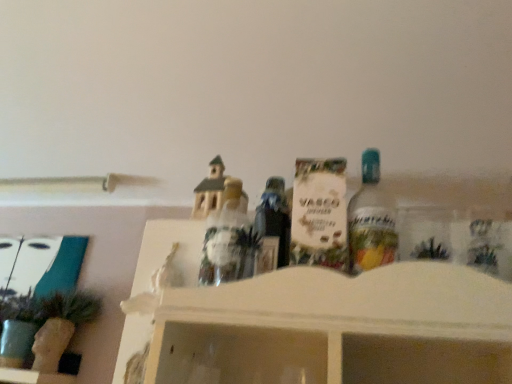
Question: Are clear glass bottle at center-right and matte brown house at center, the 2th toy positioned from the right, far apart?

Choices:
 (A) yes
 (B) no

Answer: (B)

Question: Does clear glass bottle at center-right have a smaller size compared to matte brown house at center, the second toy positioned from the left?

Choices:
 (A) yes
 (B) no

Answer: (A)

Question: Is clear glass bottle at center-right at the right side of matte brown house at center, the 2th toy positioned from the right?

Choices:
 (A) yes
 (B) no

Answer: (A)

Question: Is clear glass bottle at center-right outside matte brown house at center, the 2th toy positioned from the right?

Choices:
 (A) yes
 (B) no

Answer: (A)

Question: From the image's perspective, is clear glass bottle at center-right above matte brown house at center, the 2th toy positioned from the right?

Choices:
 (A) yes
 (B) no

Answer: (A)

Question: In terms of size, does clear glass bottle at center-right appear bigger or smaller than matte brown house at center, the 2th toy positioned from the right?

Choices:
 (A) small
 (B) big

Answer: (A)

Question: Does point (382, 258) appear closer or farther from the camera than point (224, 225)?

Choices:
 (A) farther
 (B) closer

Answer: (B)

Question: Is clear glass bottle at center-right situated inside matte brown house at center, the 2th toy positioned from the right, or outside?

Choices:
 (A) outside
 (B) inside

Answer: (A)

Question: Based on their positions, is clear glass bottle at center-right located to the left or right of matte brown house at center, the second toy positioned from the left?

Choices:
 (A) right
 (B) left

Answer: (A)

Question: Considering the positions of matte brown house at center, the second toy positioned from the left, and white matte box at center, arranged as the first toy when viewed from the right, in the image, is matte brown house at center, the second toy positioned from the left, bigger or smaller than white matte box at center, arranged as the first toy when viewed from the right,?

Choices:
 (A) big
 (B) small

Answer: (A)

Question: From the image's perspective, relative to white matte box at center, placed as the third toy when sorted from left to right, is matte brown house at center, the second toy positioned from the left, above or below?

Choices:
 (A) below
 (B) above

Answer: (A)

Question: Is matte brown house at center, the 2th toy positioned from the right, in front of or behind white matte box at center, placed as the third toy when sorted from left to right, in the image?

Choices:
 (A) front
 (B) behind

Answer: (B)

Question: Visually, is matte brown house at center, the 2th toy positioned from the right, positioned to the left or to the right of white matte box at center, arranged as the first toy when viewed from the right?

Choices:
 (A) right
 (B) left

Answer: (B)

Question: In terms of height, does translucent plastic figurine at center, the first toy positioned from the left, look taller or shorter compared to matte brown house at center, the 2th toy positioned from the right?

Choices:
 (A) tall
 (B) short

Answer: (A)

Question: Do you think translucent plastic figurine at center, the third toy from the right, is within matte brown house at center, the second toy positioned from the left, or outside of it?

Choices:
 (A) inside
 (B) outside

Answer: (B)